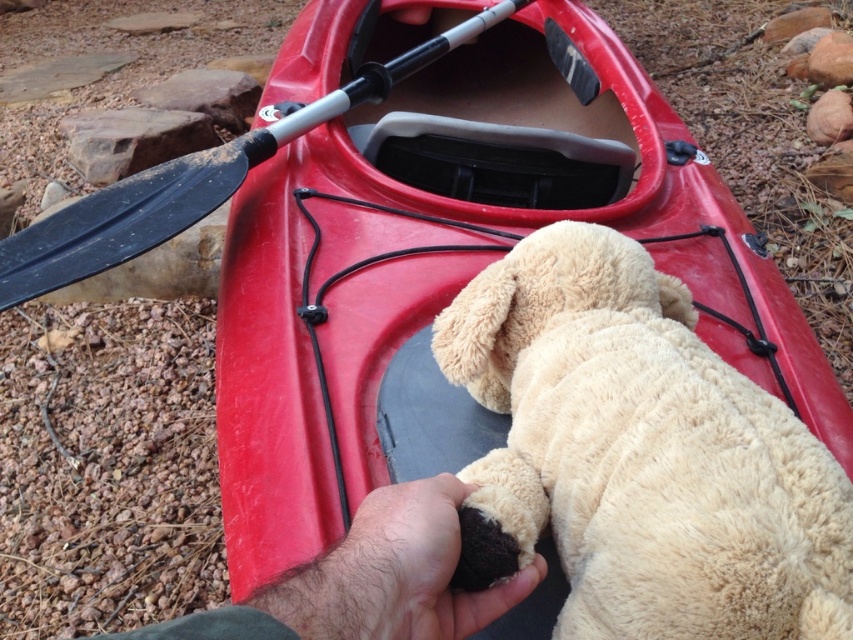
You are a photographer trying to capture the beige plush toy at center and the hairy hand at lower center in a single shot. Based on their sizes, which object would appear larger in the photo?

The beige plush toy at center would appear much larger in the photo than the hairy hand at lower center because it is much taller as the hairy hand at lower center.

From the picture: You are trying to store the rubber kayak at center and the black rubber paddle at upper left in a vertical storage rack. Given their heights, which one should you place on the lower shelf to ensure stability?

The rubber kayak at center is much taller than the black rubber paddle at upper left, so to ensure stability, you should place the rubber kayak at center on the lower shelf and the black rubber paddle at upper left on the upper shelf.

You are packing for a camping trip and need to decide whether the beige plush toy at center can fit into a storage compartment that is the same size as the black rubber paddle at upper left. Based on their sizes, can the plush toy fit?

The beige plush toy at center is not as tall as the black rubber paddle at upper left, so it can fit into the storage compartment since it is shorter.